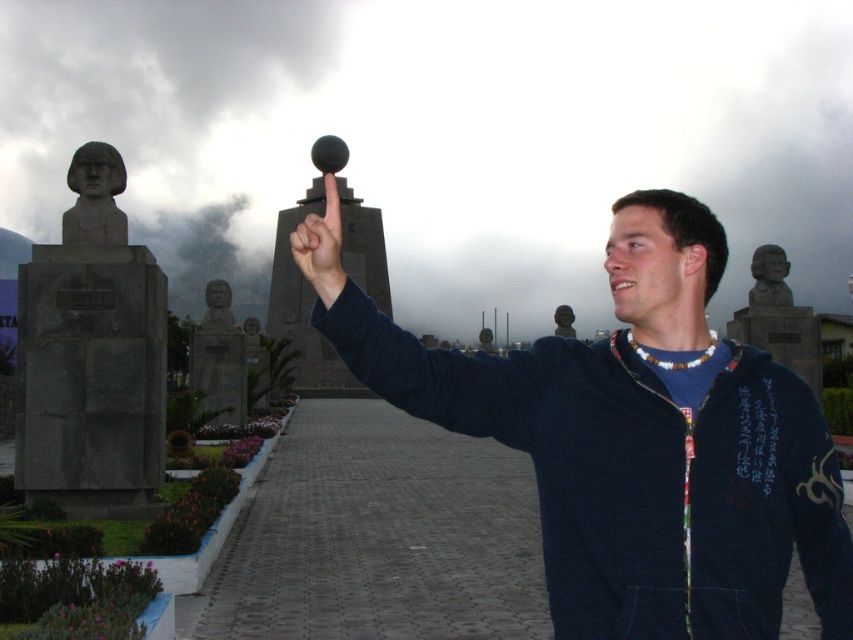
Question: Observing the image, what is the correct spatial positioning of matte black jacket at center in reference to granite bust at upper right?

Choices:
 (A) left
 (B) right

Answer: (A)

Question: Which point is closer to the camera?

Choices:
 (A) (318, 237)
 (B) (107, 184)

Answer: (A)

Question: Which object is the closest to the granite bust at upper right?

Choices:
 (A) matte black jacket at center
 (B) gray stone bust at left
 (C) matte gray stone bust at upper left
 (D) gray stone bust at center

Answer: (A)

Question: Does matte gray stone bust at upper left appear on the left side of gray stone bust at upper right?

Choices:
 (A) yes
 (B) no

Answer: (A)

Question: Based on their relative distances, which object is nearer to the matte gray bust at center?

Choices:
 (A) matte gray stone bust at upper left
 (B) gray stone bust at upper right
 (C) gray stone bust at center

Answer: (A)

Question: Does gray stone bust at left have a greater width compared to matte gray bust at center?

Choices:
 (A) no
 (B) yes

Answer: (B)